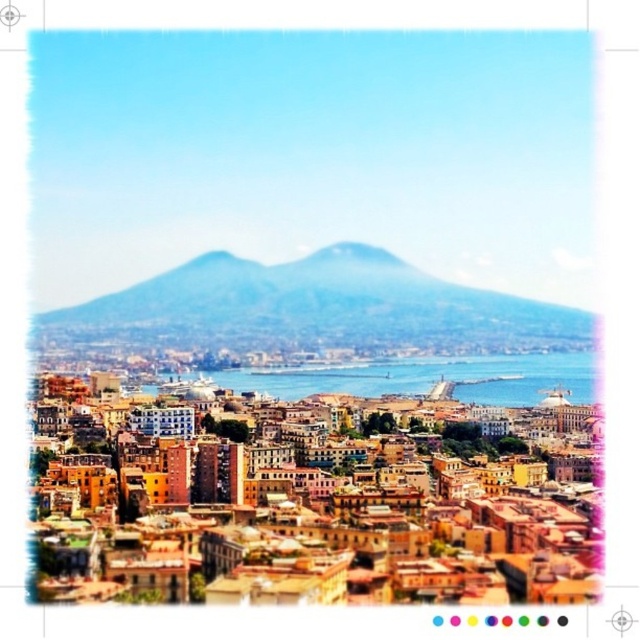
You are an artist planning to paint the cityscape. You want to ensure the blue foggy mountain at center and the blue water at center are depicted with proper spatial depth. Which object should appear closer to the viewer in your painting?

The blue foggy mountain at center should appear closer to the viewer than the blue water at center because it is positioned further to the viewer in the original scene.

You are an architect planning to build a new observation deck in the city. You want to ensure that the deck will have an unobstructed view of both the blue foggy mountain at center and the blue water at center. Based on the scene description, which object is taller and might block the view of the other if placed in front?

The blue foggy mountain at center is taller than the blue water at center. Therefore, if the mountain were placed in front, it might block the view of the water. However, since the mountain is already at the center and the water is also at the center, their positions as described suggest they are part of the backdrop and midground respectively, so their natural arrangement likely allows both to be visible without obstruction.